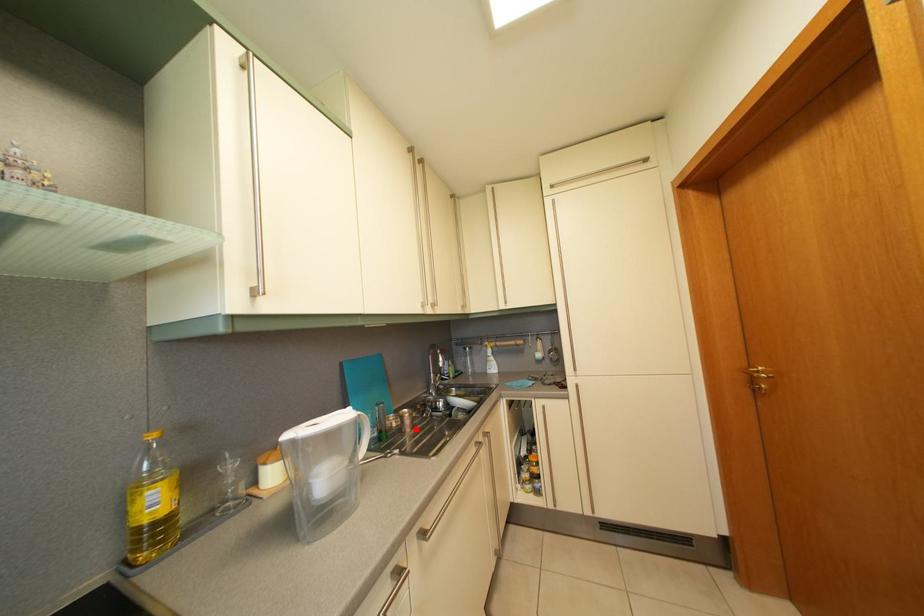
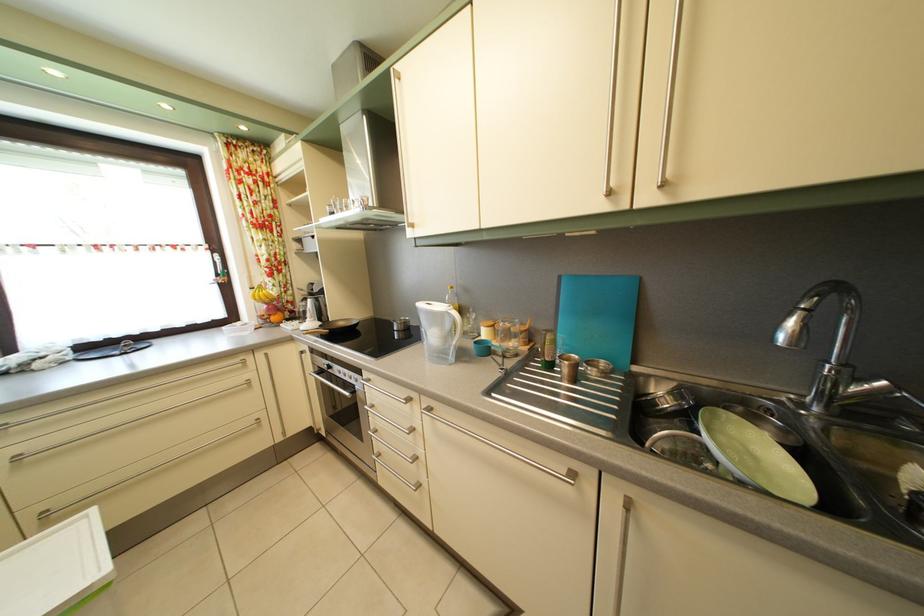
Where in the second image is the point corresponding to the highlighted location from the first image?

(574, 378)